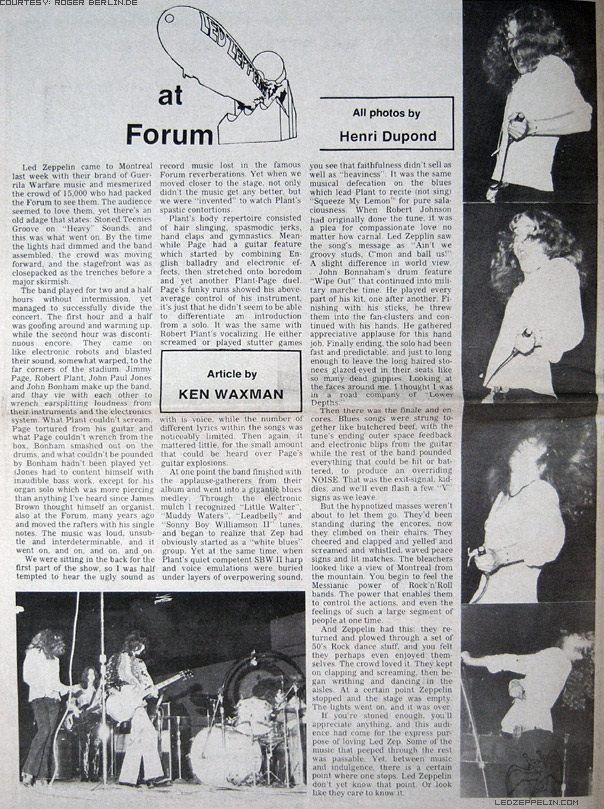
Find the location of a particular element. The width and height of the screenshot is (604, 809). photographs is located at coordinates [x=170, y=667], [x=528, y=696], [x=541, y=506], [x=548, y=308], [x=532, y=121].